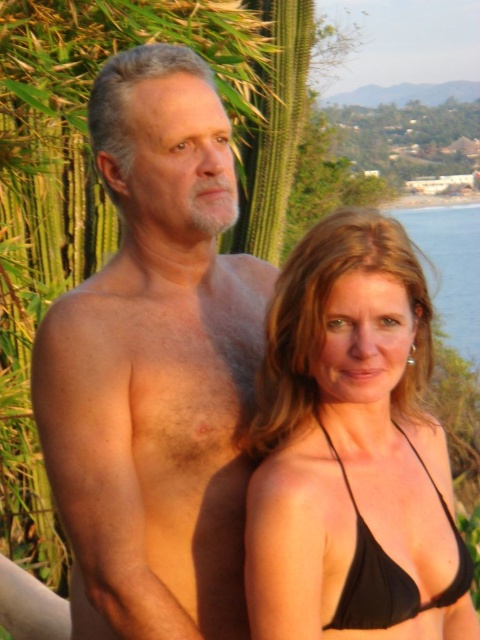
You are standing at the origin point of the coordinate system in this image. You want to reach the point labeled as point (475, 349). However, there is an obstacle at point (201, 65). Can you go straight towards your destination without detouring around the obstacle?

Since point (201, 65) is in front of point (475, 349), moving straight towards point (475, 349) would require passing through point (201, 65) first. Therefore, you cannot go straight without encountering the obstacle at point (201, 65) and must detour around it.

You are a photographer capturing a couple at the beach. You need to ensure the black matte bikini top at center and the blue water at right are both visible in your shot. Based on their positions, which object is closer to the left side of the frame?

The black matte bikini top at center is closer to the left side of the frame than the blue water at right.